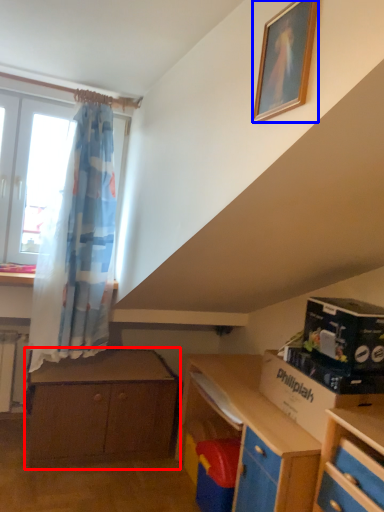
Question: Which point is further to the camera, chest of drawers (highlighted by a red box) or picture frame (highlighted by a blue box)?

Choices:
 (A) chest of drawers
 (B) picture frame

Answer: (A)